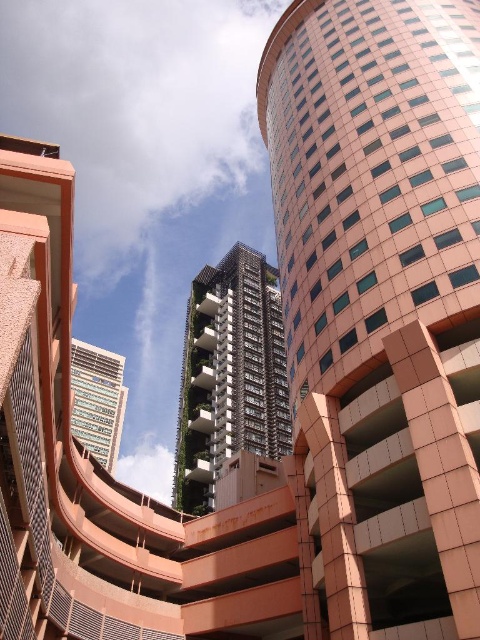
Question: Does pink tile building at center lie behind metallic glass skyscraper at center?

Choices:
 (A) no
 (B) yes

Answer: (A)

Question: Which point is closer to the camera?

Choices:
 (A) (231, 340)
 (B) (108, 394)

Answer: (A)

Question: Considering the relative positions of pink tile building at center and green textured building at center in the image provided, where is pink tile building at center located with respect to green textured building at center?

Choices:
 (A) above
 (B) below

Answer: (A)

Question: Estimate the real-world distances between objects in this image. Which object is closer to the pink tile building at center?

Choices:
 (A) metallic glass skyscraper at center
 (B) green textured building at center

Answer: (B)

Question: Among these points, which one is farthest from the camera?

Choices:
 (A) (248, 333)
 (B) (441, 237)

Answer: (A)

Question: Does pink tile building at center have a greater width compared to green textured building at center?

Choices:
 (A) no
 (B) yes

Answer: (B)